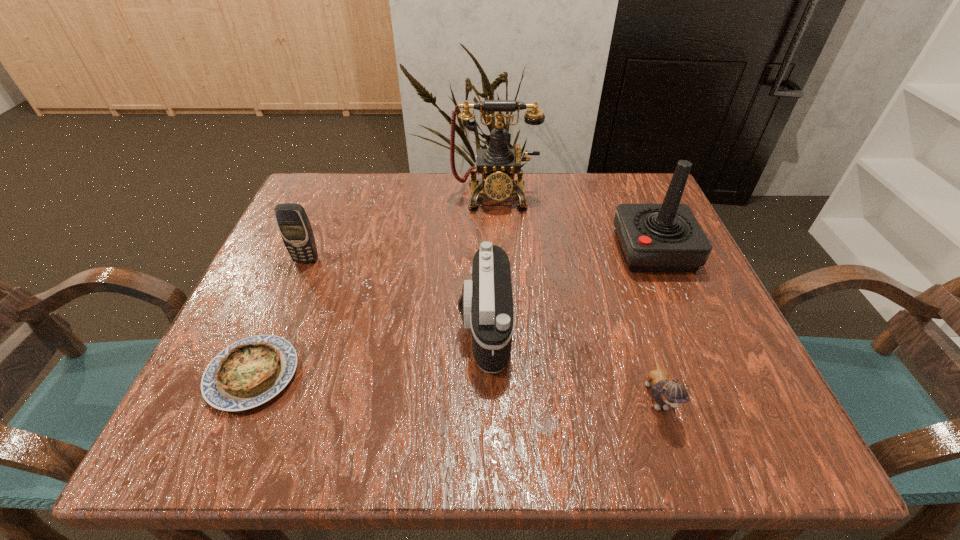
Where is `telephone`? telephone is located at coordinates (498, 164).

Locate an element on the screen. Image resolution: width=960 pixels, height=540 pixels. joystick is located at coordinates pyautogui.click(x=667, y=237).

Identify the location of cellular telephone. (294, 226).

This screenshot has width=960, height=540. Identify the location of camera. (486, 304).

You are a GUI agent. You are given a task and a screenshot of the screen. Output one action in this format:
    pyautogui.click(x=<x>, y=<y>)
    Task: Click on the fifth tallest object
    
    Given the screenshot: What is the action you would take?
    pyautogui.click(x=666, y=392)

Find the location of a particular element. Image resolution: width=960 pixels, height=540 pixels. the shortest object is located at coordinates (249, 372).

Identify the location of free point located 0.270m on the front of the telephone, featuring the rotary dial. Image resolution: width=960 pixels, height=540 pixels. (498, 299).

This screenshot has width=960, height=540. What are the coordinates of `blank space located 0.230m on the front-facing side of the joystick` in the screenshot? It's located at (508, 251).

You are a GUI agent. You are given a task and a screenshot of the screen. Output one action in this format:
    pyautogui.click(x=<x>, y=<y>)
    Task: Click on the free space located 0.330m on the front-facing side of the joystick
    The height and width of the screenshot is (540, 960).
    Given the screenshot: What is the action you would take?
    pyautogui.click(x=461, y=251)

The image size is (960, 540). Find the location of `vacant region located on the front-facing side of the joystick`. vacant region located on the front-facing side of the joystick is located at coordinates (551, 251).